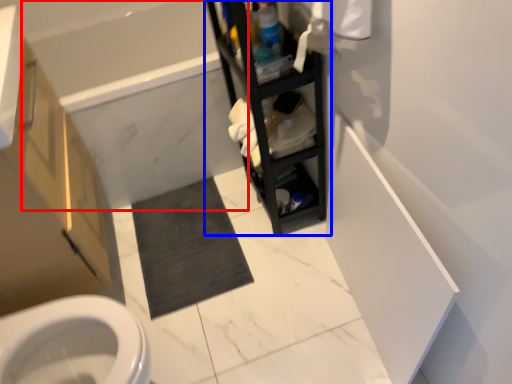
Question: Which point is closer to the camera, bath (highlighted by a red box) or shelf (highlighted by a blue box)?

Choices:
 (A) bath
 (B) shelf

Answer: (B)